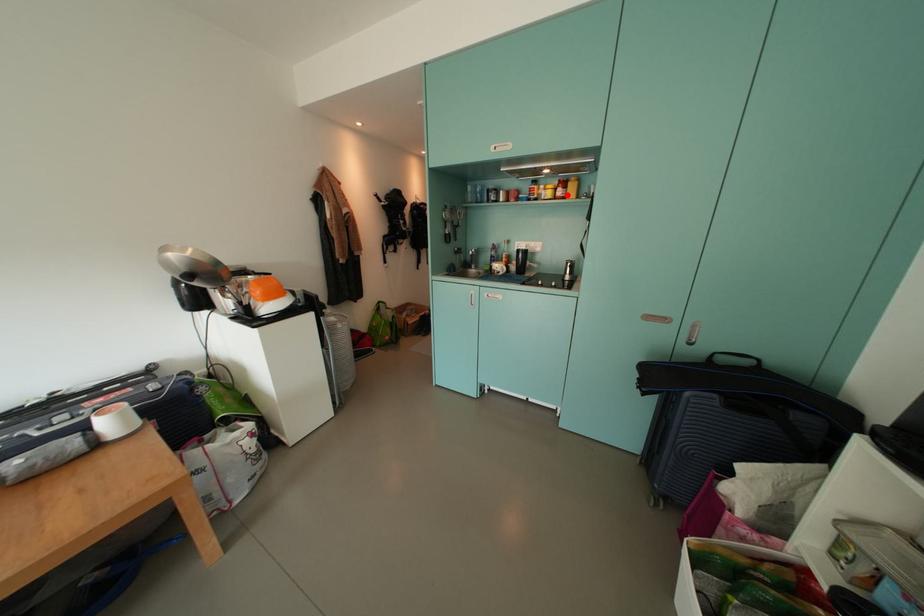
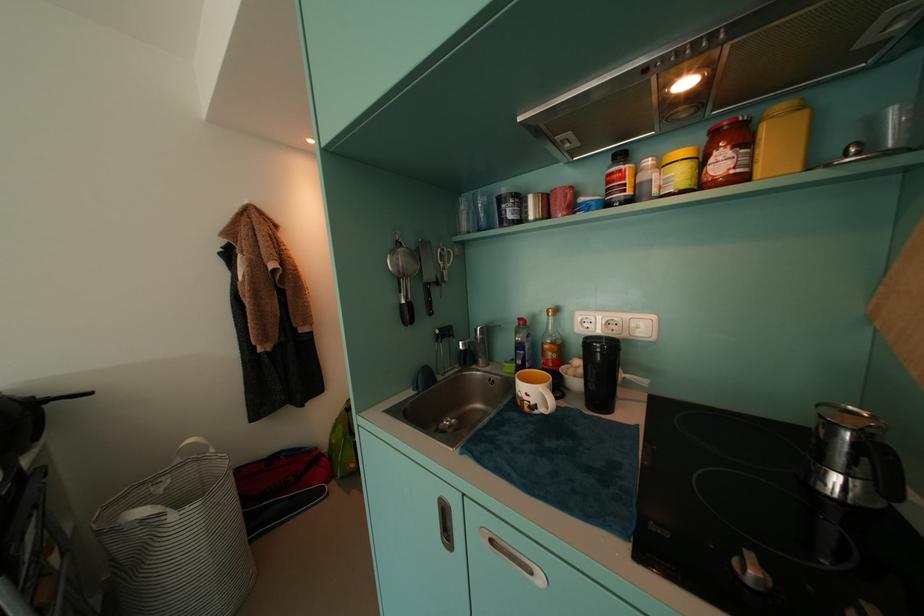
Question: A red point is marked in image1. In image2, is the corresponding 3D point closer to the camera or farther? Reply with the corresponding letter.

Choices:
 (A) The corresponding 3D point is closer.
 (B) The corresponding 3D point is farther.

Answer: (B)